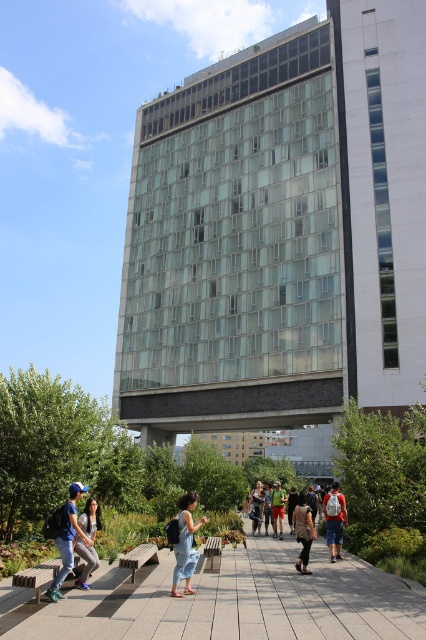
You are standing at the entrance of the building and want to reach the point marked as point (181, 509). There is an obstacle at point (340, 515). Can you walk directly towards your destination without going around the obstacle?

Yes, you can walk directly towards point (181, 509) because it is in front of point (340, 515), meaning the obstacle is behind your destination and won

You are standing at the entrance of the building and want to find the matte blue cap at lower left. According to the coordinates provided, where should you look relative to the building?

The matte blue cap at lower left is located at coordinates point (x=68, y=538), which is near the lower left area of the image, so you should look towards the lower left direction from the entrance of the building.

You are standing on the paved pathway in front of the tall building and see a person wearing a denim dress at center and denim shorts at center. Which clothing item is positioned higher on the person?

The denim dress at center is located above the denim shorts at center, so the dress is positioned higher on the person.